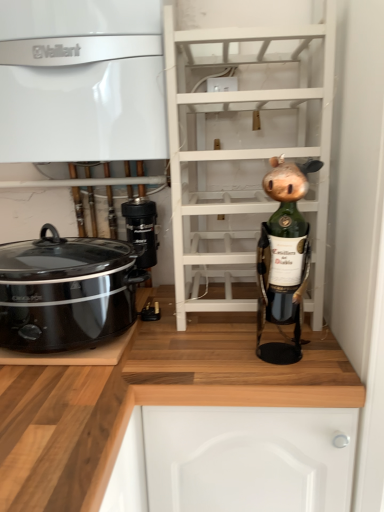
This screenshot has height=512, width=384. What do you see at coordinates (283, 257) in the screenshot?
I see `green matte wine bottle at right` at bounding box center [283, 257].

Identify the location of black plastic slow cooker at left. (66, 292).

This screenshot has height=512, width=384. I want to click on white wooden shelf at center, so click(x=243, y=149).

This screenshot has height=512, width=384. Describe the element at coordinates (83, 112) in the screenshot. I see `white glossy vaillant boiler at upper left, the second cabinetry ordered from the bottom` at that location.

What do you see at coordinates (142, 229) in the screenshot? This screenshot has height=512, width=384. I see `black plastic camera at center` at bounding box center [142, 229].

Locate an element on the screen. green matte wine bottle at right is located at coordinates (283, 257).

Choose the correct answer: Is black plastic camera at center inside white wooden shelf at center or outside it?

black plastic camera at center is not inside white wooden shelf at center, it's outside.

Looking at their sizes, would you say black plastic camera at center is wider or thinner than white wooden shelf at center?

In the image, black plastic camera at center appears to be more narrow than white wooden shelf at center.

Considering the positions of objects black plastic camera at center and white wooden shelf at center in the image provided, who is more to the right, black plastic camera at center or white wooden shelf at center?

From the viewer's perspective, white wooden shelf at center appears more on the right side.

Is there a large distance between black plastic camera at center and green matte wine bottle at right?

No, black plastic camera at center is not far from green matte wine bottle at right.

Between point (126, 210) and point (265, 283), which one is positioned behind?

The point (126, 210) is farther from the camera.

Is black plastic camera at center further to camera compared to green matte wine bottle at right?

Yes, it is behind green matte wine bottle at right.

Would you say black plastic slow cooker at left is inside or outside white glossy vaillant boiler at upper left, the second cabinetry ordered from the bottom?

black plastic slow cooker at left exists outside the volume of white glossy vaillant boiler at upper left, the second cabinetry ordered from the bottom.

From a real-world perspective, which object rests below the other?

black plastic slow cooker at left is physically lower.

Visually, is black plastic slow cooker at left positioned to the left or to the right of white glossy vaillant boiler at upper left, placed as the first cabinetry when sorted from top to bottom?

black plastic slow cooker at left is positioned on white glossy vaillant boiler at upper left, placed as the first cabinetry when sorted from top to bottom,'s left side.

Are wooden at lower right, which is the second cabinetry in top-to-bottom order, and green matte wine bottle at right far apart?

No, wooden at lower right, which is the second cabinetry in top-to-bottom order, is not far from green matte wine bottle at right.

In the image, is wooden at lower right, which is counted as the 1th cabinetry, starting from the bottom, on the left side or the right side of green matte wine bottle at right?

From the image, it's evident that wooden at lower right, which is counted as the 1th cabinetry, starting from the bottom, is to the left of green matte wine bottle at right.

Measure the distance from wooden at lower right, which is counted as the 1th cabinetry, starting from the bottom, to green matte wine bottle at right.

wooden at lower right, which is counted as the 1th cabinetry, starting from the bottom, is 8.52 inches from green matte wine bottle at right.

Is wooden at lower right, which is counted as the 1th cabinetry, starting from the bottom, inside or outside of green matte wine bottle at right?

wooden at lower right, which is counted as the 1th cabinetry, starting from the bottom, is not enclosed by green matte wine bottle at right.

Looking at the image, does white wooden shelf at center seem bigger or smaller compared to white glossy vaillant boiler at upper left, the second cabinetry ordered from the bottom?

Clearly, white wooden shelf at center is larger in size than white glossy vaillant boiler at upper left, the second cabinetry ordered from the bottom.

Between white wooden shelf at center and white glossy vaillant boiler at upper left, placed as the first cabinetry when sorted from top to bottom, which one is positioned behind?

white glossy vaillant boiler at upper left, placed as the first cabinetry when sorted from top to bottom, is behind.

From a real-world perspective, is white wooden shelf at center physically located above or below white glossy vaillant boiler at upper left, the second cabinetry ordered from the bottom?

white wooden shelf at center is below white glossy vaillant boiler at upper left, the second cabinetry ordered from the bottom.

Would you say white wooden shelf at center is outside white glossy vaillant boiler at upper left, the second cabinetry ordered from the bottom?

Absolutely, white wooden shelf at center is external to white glossy vaillant boiler at upper left, the second cabinetry ordered from the bottom.

Between white glossy vaillant boiler at upper left, placed as the first cabinetry when sorted from top to bottom, and wooden at lower right, which is counted as the 1th cabinetry, starting from the bottom, which one has more height?

wooden at lower right, which is counted as the 1th cabinetry, starting from the bottom, is taller.

Is white glossy vaillant boiler at upper left, the second cabinetry ordered from the bottom, smaller than wooden at lower right, which is the second cabinetry in top-to-bottom order?

Yes.

From the image's perspective, between white glossy vaillant boiler at upper left, placed as the first cabinetry when sorted from top to bottom, and wooden at lower right, which is the second cabinetry in top-to-bottom order, who is located below?

From the image's view, wooden at lower right, which is the second cabinetry in top-to-bottom order, is below.

Looking at their sizes, would you say white glossy vaillant boiler at upper left, placed as the first cabinetry when sorted from top to bottom, is wider or thinner than wooden at lower right, which is the second cabinetry in top-to-bottom order?

white glossy vaillant boiler at upper left, placed as the first cabinetry when sorted from top to bottom, is thinner than wooden at lower right, which is the second cabinetry in top-to-bottom order.

Which object is closer to the camera, white wooden shelf at center or black plastic slow cooker at left?

Positioned in front is black plastic slow cooker at left.

This screenshot has height=512, width=384. In order to click on shelf above the black plastic slow cooker at left (from the image's perspective) in this screenshot , I will do `click(243, 149)`.

Considering the sizes of objects white wooden shelf at center and black plastic slow cooker at left in the image provided, who is thinner, white wooden shelf at center or black plastic slow cooker at left?

black plastic slow cooker at left.

Between white wooden shelf at center and black plastic slow cooker at left, which one has larger size?

white wooden shelf at center is bigger.

I want to click on appliance behind the white wooden shelf at center, so click(142, 229).

Where is `toy that is in front of the black plastic camera at center`? toy that is in front of the black plastic camera at center is located at coordinates (283, 257).

Based on the photo, when comparing their distances from wooden at lower right, which is the second cabinetry in top-to-bottom order, does white wooden shelf at center or black plastic camera at center seem closer?

black plastic camera at center lies closer to wooden at lower right, which is the second cabinetry in top-to-bottom order, than the other object.

Estimate the real-world distances between objects in this image. Which object is further from black plastic slow cooker at left, wooden at lower right, which is the second cabinetry in top-to-bottom order, or white glossy vaillant boiler at upper left, placed as the first cabinetry when sorted from top to bottom?

white glossy vaillant boiler at upper left, placed as the first cabinetry when sorted from top to bottom, is further to black plastic slow cooker at left.

When comparing their distances from wooden at lower right, which is counted as the 1th cabinetry, starting from the bottom, does white glossy vaillant boiler at upper left, placed as the first cabinetry when sorted from top to bottom, or black plastic camera at center seem further?

Among the two, white glossy vaillant boiler at upper left, placed as the first cabinetry when sorted from top to bottom, is located further to wooden at lower right, which is counted as the 1th cabinetry, starting from the bottom.

When comparing their distances from green matte wine bottle at right, does wooden at lower right, which is the second cabinetry in top-to-bottom order, or black plastic camera at center seem further?

black plastic camera at center is further to green matte wine bottle at right.

Estimate the real-world distances between objects in this image. Which object is closer to green matte wine bottle at right, white glossy vaillant boiler at upper left, placed as the first cabinetry when sorted from top to bottom, or black plastic camera at center?

Among the two, black plastic camera at center is located nearer to green matte wine bottle at right.

Looking at the image, which one is located further to black plastic slow cooker at left, white glossy vaillant boiler at upper left, the second cabinetry ordered from the bottom, or black plastic camera at center?

The object further to black plastic slow cooker at left is white glossy vaillant boiler at upper left, the second cabinetry ordered from the bottom.

From the image, which object appears to be farther from white wooden shelf at center, black plastic slow cooker at left or green matte wine bottle at right?

Among the two, black plastic slow cooker at left is located further to white wooden shelf at center.

Based on their spatial positions, is green matte wine bottle at right or white wooden shelf at center further from white glossy vaillant boiler at upper left, placed as the first cabinetry when sorted from top to bottom?

green matte wine bottle at right is positioned further to the anchor white glossy vaillant boiler at upper left, placed as the first cabinetry when sorted from top to bottom.

I want to click on toy between white glossy vaillant boiler at upper left, the second cabinetry ordered from the bottom, and wooden at lower right, which is the second cabinetry in top-to-bottom order, in the vertical direction, so click(283, 257).

Find the location of a particular element. appliance between black plastic slow cooker at left and green matte wine bottle at right in the horizontal direction is located at coordinates (142, 229).

Where is `shelf between white glossy vaillant boiler at upper left, the second cabinetry ordered from the bottom, and black plastic slow cooker at left, in the vertical direction`? The width and height of the screenshot is (384, 512). shelf between white glossy vaillant boiler at upper left, the second cabinetry ordered from the bottom, and black plastic slow cooker at left, in the vertical direction is located at coordinates (243, 149).

The width and height of the screenshot is (384, 512). I want to click on home appliance that lies between white glossy vaillant boiler at upper left, the second cabinetry ordered from the bottom, and wooden at lower right, which is counted as the 1th cabinetry, starting from the bottom, from top to bottom, so click(66, 292).